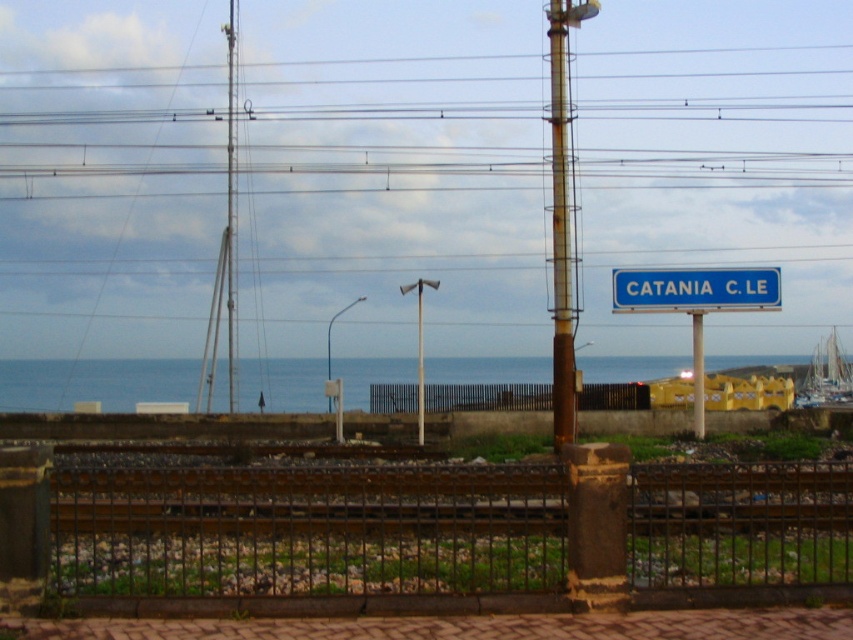
Is blue water at center to the right of rusty metal pole at center from the viewer's perspective?

Incorrect, blue water at center is not on the right side of rusty metal pole at center.

Between blue water at center and rusty metal pole at center, which one is positioned higher?

rusty metal pole at center is higher up.

Which is in front, point (296, 403) or point (560, 84)?

Positioned in front is point (560, 84).

Locate an element on the screen. The width and height of the screenshot is (853, 640). blue water at center is located at coordinates (93, 381).

Does point (624, 556) lie in front of point (445, 397)?

Yes, it is in front of point (445, 397).

Measure the distance between point [521,561] and camera.

12.41 meters

Identify the location of rusty metal fence at center. (311, 531).

Is rusty metal pole at center positioned in front of metallic pole at upper center?

Yes, it is in front of metallic pole at upper center.

Consider the image. Is rusty metal pole at center wider than metallic pole at upper center?

Yes.

At what (x,y) coordinates should I click in order to perform the action: click on rusty metal pole at center. Please return your answer as a coordinate pair (x, y). This screenshot has width=853, height=640. Looking at the image, I should click on (561, 224).